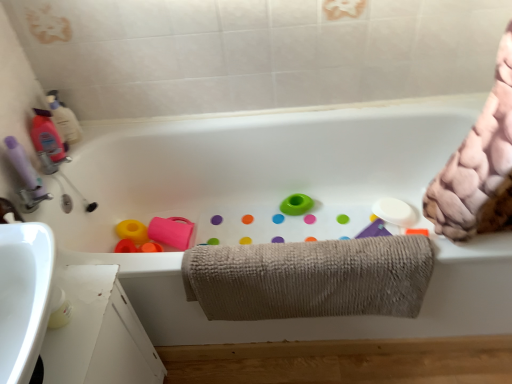
Question: Does matte pink bottle at left, acting as the 2th cleaning product starting from the bottom, have a smaller size compared to translucent plastic bottle at upper left, which ranks as the third cleaning product in bottom-to-top order?

Choices:
 (A) yes
 (B) no

Answer: (B)

Question: From a real-world perspective, is matte pink bottle at left, the 2th cleaning product positioned from the top, located beneath translucent plastic bottle at upper left, which ranks as the third cleaning product in bottom-to-top order?

Choices:
 (A) no
 (B) yes

Answer: (B)

Question: Is matte pink bottle at left, acting as the 2th cleaning product starting from the bottom, bigger than translucent plastic bottle at upper left, which ranks as the third cleaning product in bottom-to-top order?

Choices:
 (A) yes
 (B) no

Answer: (A)

Question: Is matte pink bottle at left, the 2th cleaning product positioned from the top, closer to the viewer compared to translucent plastic bottle at upper left, which ranks as the third cleaning product in bottom-to-top order?

Choices:
 (A) no
 (B) yes

Answer: (B)

Question: Is matte pink bottle at left, the 2th cleaning product positioned from the top, thinner than translucent plastic bottle at upper left, arranged as the 1th cleaning product when viewed from the top?

Choices:
 (A) yes
 (B) no

Answer: (B)

Question: Is purple matte bottle at left, which ranks as the first cleaning product in bottom-to-top order, spatially inside beige textured towel at center, or outside of it?

Choices:
 (A) outside
 (B) inside

Answer: (A)

Question: Is point (16, 155) positioned closer to the camera than point (285, 243)?

Choices:
 (A) closer
 (B) farther

Answer: (B)

Question: In terms of size, does purple matte bottle at left, marked as the third cleaning product in a top-to-bottom arrangement, appear bigger or smaller than beige textured towel at center?

Choices:
 (A) small
 (B) big

Answer: (A)

Question: From their relative heights in the image, would you say purple matte bottle at left, marked as the third cleaning product in a top-to-bottom arrangement, is taller or shorter than beige textured towel at center?

Choices:
 (A) tall
 (B) short

Answer: (B)

Question: Is purple matte bottle at left, marked as the third cleaning product in a top-to-bottom arrangement, wider or thinner than white ceramic bathtub at center?

Choices:
 (A) wide
 (B) thin

Answer: (B)

Question: From the image's perspective, is purple matte bottle at left, marked as the third cleaning product in a top-to-bottom arrangement, above or below white ceramic bathtub at center?

Choices:
 (A) below
 (B) above

Answer: (B)

Question: Is point (12, 165) positioned closer to the camera than point (298, 168)?

Choices:
 (A) farther
 (B) closer

Answer: (B)

Question: Is purple matte bottle at left, which ranks as the first cleaning product in bottom-to-top order, bigger or smaller than white ceramic bathtub at center?

Choices:
 (A) big
 (B) small

Answer: (B)

Question: From a real-world perspective, relative to purple matte bottle at left, marked as the third cleaning product in a top-to-bottom arrangement, is beige textured towel at center vertically above or below?

Choices:
 (A) above
 (B) below

Answer: (B)

Question: Is point (249, 246) positioned closer to the camera than point (28, 187)?

Choices:
 (A) farther
 (B) closer

Answer: (B)